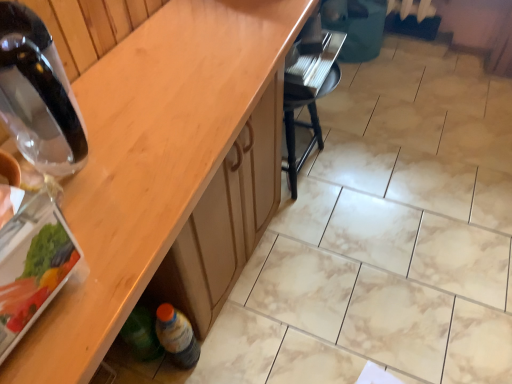
Question: In terms of width, does wooden at lower left look wider or thinner when compared to translucent plastic bottle at lower left, placed as the 2th bottle when sorted from top to bottom?

Choices:
 (A) thin
 (B) wide

Answer: (B)

Question: Considering the positions of point (223, 4) and point (164, 345), is point (223, 4) closer or farther from the camera than point (164, 345)?

Choices:
 (A) farther
 (B) closer

Answer: (B)

Question: Estimate the real-world distances between objects in this image. Which object is farther from the black plastic chair at center?

Choices:
 (A) translucent plastic bottle at lower left, the first bottle from the back
 (B) wooden at lower left
 (C) transparent glass bottle at left, which is the 2th bottle from bottom to top

Answer: (C)

Question: Which object is positioned closest to the transparent glass bottle at left, the first bottle viewed from the front?

Choices:
 (A) wooden at lower left
 (B) translucent plastic bottle at lower left, the first bottle from the back
 (C) black plastic chair at center

Answer: (A)